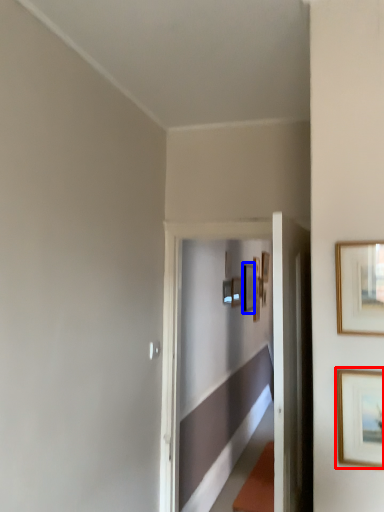
Question: Which of the following is the farthest to the observer, picture frame (highlighted by a red box) or picture frame (highlighted by a blue box)?

Choices:
 (A) picture frame
 (B) picture frame

Answer: (B)